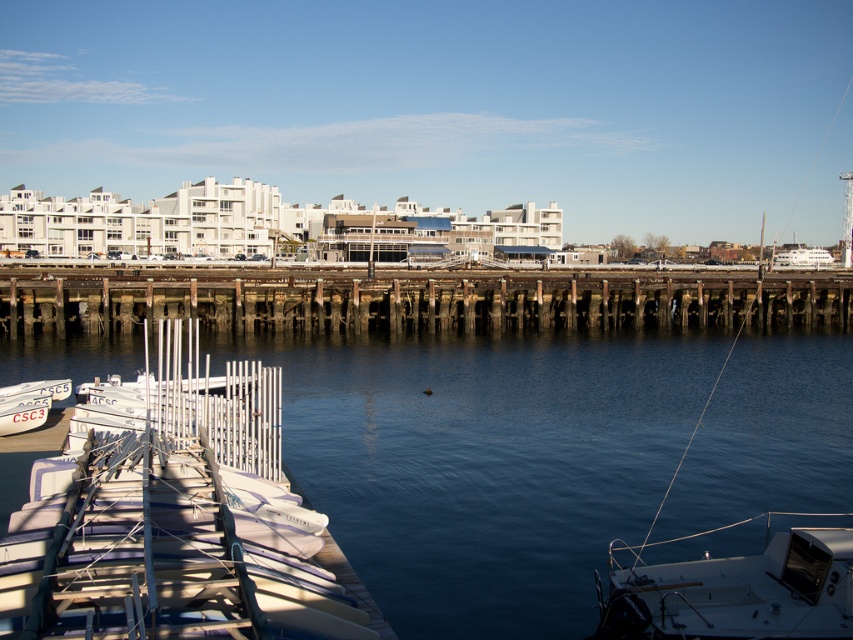
Question: Which object is closer to the camera taking this photo?

Choices:
 (A) weathered wood dock at center
 (B) white matte boat at lower right

Answer: (B)

Question: Is white matte dock at lower left further to camera compared to white matte boat at lower right?

Choices:
 (A) no
 (B) yes

Answer: (B)

Question: Is weathered wood dock at center below white matte boat at lower right?

Choices:
 (A) yes
 (B) no

Answer: (B)

Question: Among these objects, which one is nearest to the camera?

Choices:
 (A) white matte boat at left
 (B) weathered wood dock at center
 (C) white matte boat at lower right

Answer: (A)

Question: Which of the following is the closest to the observer?

Choices:
 (A) white matte boat at left
 (B) white matte dock at lower left
 (C) white matte boat at lower right

Answer: (A)

Question: Does white matte boat at left have a lesser width compared to weathered wood dock at center?

Choices:
 (A) no
 (B) yes

Answer: (B)